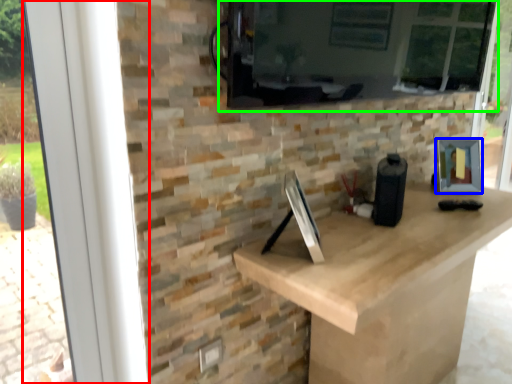
Question: Considering the real-world distances, which object is closest to window frame (highlighted by a red box)? picture frame (highlighted by a blue box) or window screen (highlighted by a green box).

Choices:
 (A) picture frame
 (B) window screen

Answer: (B)